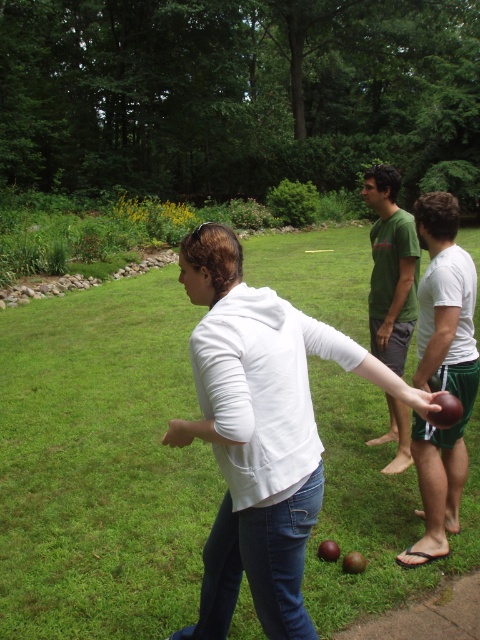
Does green grass at center have a lesser height compared to green t-shirt at center?

In fact, green grass at center may be taller than green t-shirt at center.

Does point (85, 316) come farther from viewer compared to point (398, 280)?

Yes, point (85, 316) is behind point (398, 280).

Locate an element on the screen. green grass at center is located at coordinates (100, 465).

This screenshot has width=480, height=640. In order to click on green grass at center in this screenshot , I will do `click(100, 465)`.

Which is below, matte brown ball at right or green t-shirt at center?

matte brown ball at right is lower down.

Between point (422, 420) and point (382, 298), which one is positioned in front?

Point (422, 420) is more forward.

I want to click on matte brown ball at right, so click(442, 371).

Is green grass at center thinner than matte brown ball at right?

In fact, green grass at center might be wider than matte brown ball at right.

Does point (149, 506) lie in front of point (474, 301)?

No, (149, 506) is behind (474, 301).

Locate an element on the screen. Image resolution: width=480 pixels, height=640 pixels. green grass at center is located at coordinates (100, 465).